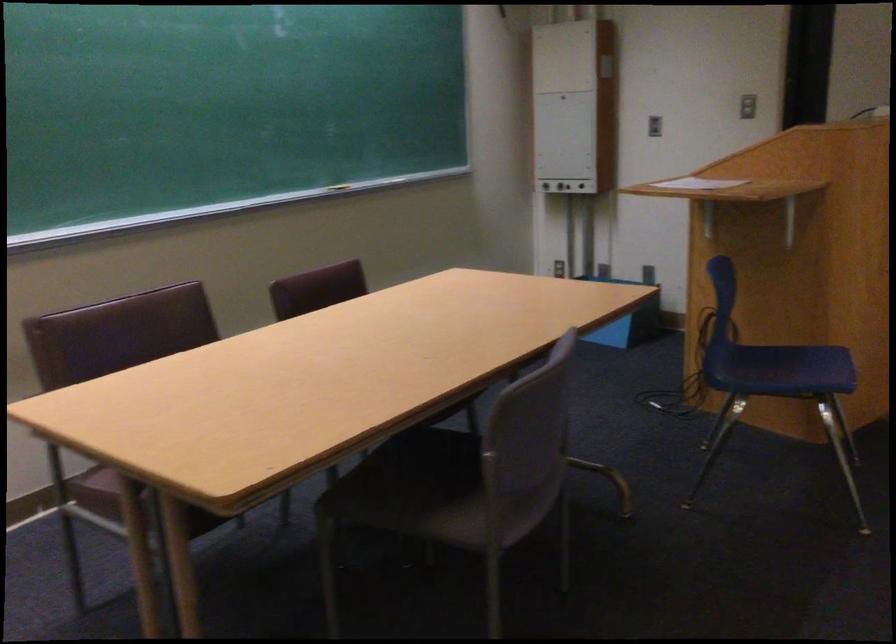
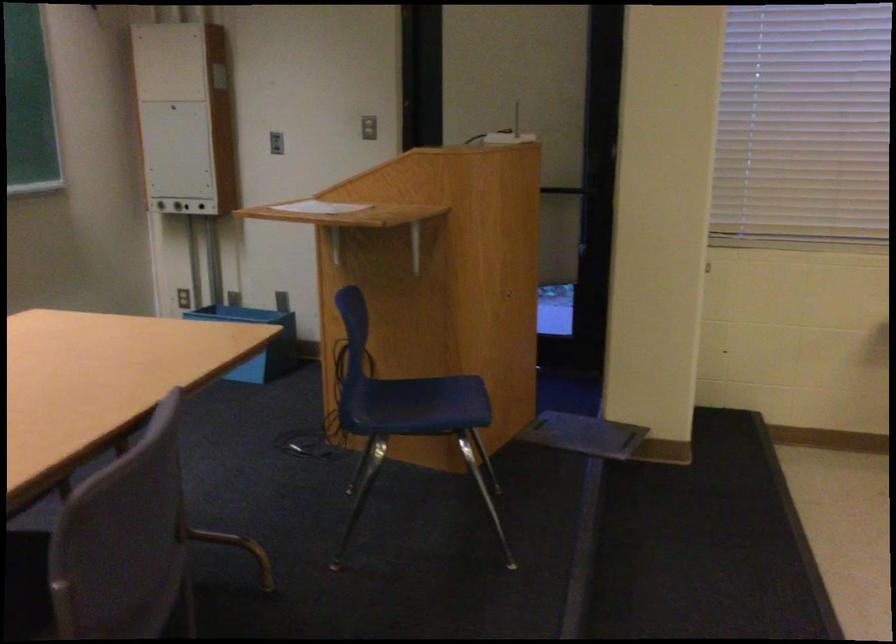
Where in the second image is the point corresponding to point 640,295 from the first image?

(256, 341)